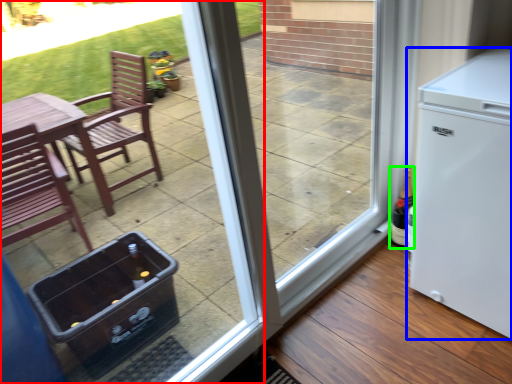
Question: Which object is positioned farthest from door (highlighted by a red box)? Select from refrigerator (highlighted by a blue box) and bottle (highlighted by a green box).

Choices:
 (A) refrigerator
 (B) bottle

Answer: (B)